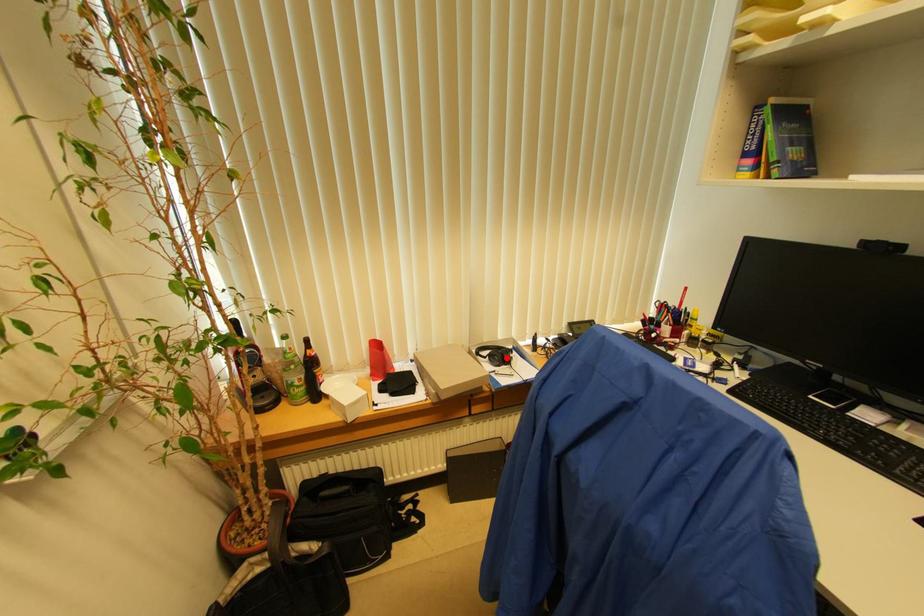
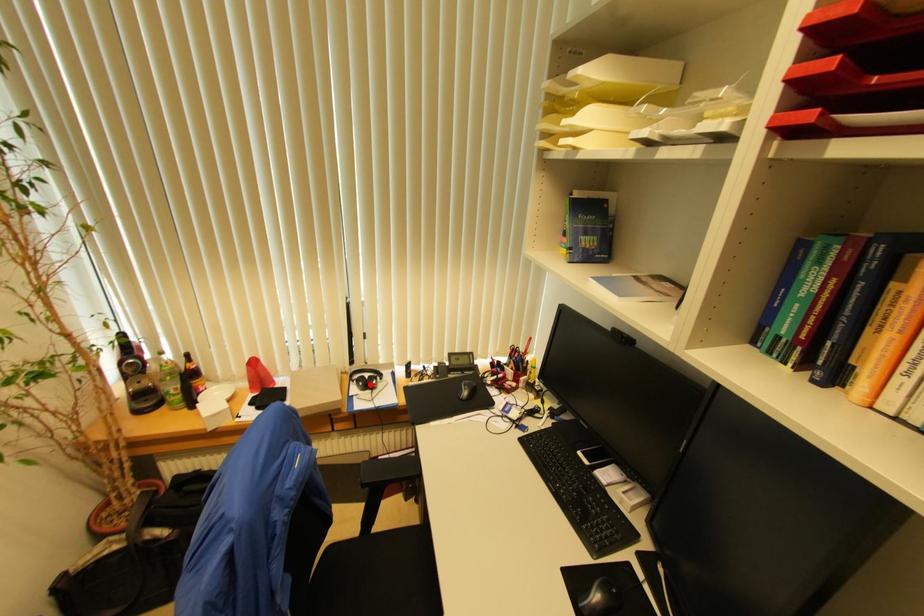
I am providing you with two images of the same scene from different viewpoints. A red point is marked on the first image and another point is marked on the second image. Is the red point in image1 aligned with the point shown in image2?

Yes